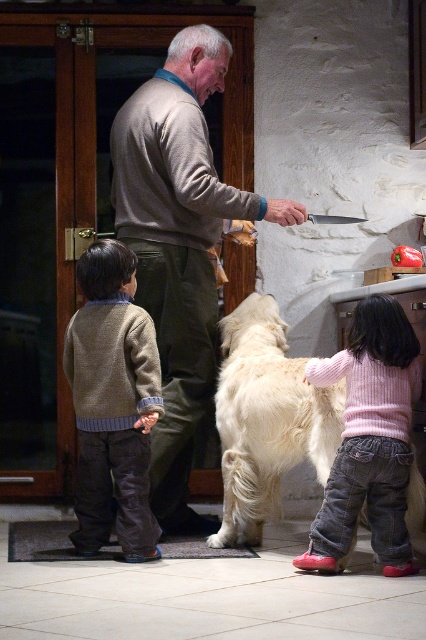
Question: Estimate the real-world distances between objects in this image. Which object is closer to the light brown sweater at center?

Choices:
 (A) knit sweater at left
 (B) white fluffy dog at center

Answer: (A)

Question: Can you confirm if knit sweater at left is wider than white fluffy dog at center?

Choices:
 (A) no
 (B) yes

Answer: (A)

Question: From the image, what is the correct spatial relationship of light brown sweater at center in relation to white fluffy dog at center?

Choices:
 (A) above
 (B) below

Answer: (A)

Question: Which is nearer to the knit sweater at left?

Choices:
 (A) light brown sweater at center
 (B) white fluffy dog at center

Answer: (A)

Question: Which object is farther from the camera taking this photo?

Choices:
 (A) white fluffy dog at center
 (B) light brown sweater at center
 (C) knit sweater at left

Answer: (B)

Question: Considering the relative positions of knit sweater at left and white fluffy dog at center in the image provided, where is knit sweater at left located with respect to white fluffy dog at center?

Choices:
 (A) below
 (B) above

Answer: (B)